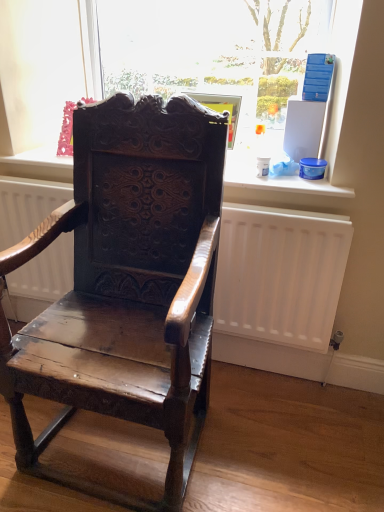
Image resolution: width=384 pixels, height=512 pixels. Describe the element at coordinates (127, 280) in the screenshot. I see `shiny dark wood chair at center` at that location.

Find the location of a particular element. The image size is (384, 512). white matte radiator at center is located at coordinates (280, 274).

From the image's perspective, between transparent glass at upper center and shiny dark wood chair at center, which one is located above?

From the image's view, transparent glass at upper center is above.

Is transparent glass at upper center turned away from shiny dark wood chair at center?

No, transparent glass at upper center is not facing away from shiny dark wood chair at center.

Does transparent glass at upper center have a larger size compared to shiny dark wood chair at center?

No, transparent glass at upper center is not bigger than shiny dark wood chair at center.

Considering the relative positions of transparent glass at upper center and shiny dark wood chair at center in the image provided, is transparent glass at upper center to the left of shiny dark wood chair at center from the viewer's perspective?

Incorrect, transparent glass at upper center is not on the left side of shiny dark wood chair at center.

Is shiny dark wood chair at center turned away from transparent glass at upper center?

Yes.

Identify the location of bay window located on the right of shiny dark wood chair at center. This screenshot has width=384, height=512. [37, 70].

Is shiny dark wood chair at center not within transparent glass at upper center?

Indeed, shiny dark wood chair at center is completely outside transparent glass at upper center.

Is shiny dark wood chair at center far away from transparent glass at upper center?

That's not correct — shiny dark wood chair at center is a little close to transparent glass at upper center.

Which of these two, transparent glass at upper center or white matte radiator at center, is wider?

With larger width is white matte radiator at center.

Considering the points (204, 31) and (66, 193), which point is behind, point (204, 31) or point (66, 193)?

Positioned behind is point (204, 31).

Is white matte radiator at center surrounded by transparent glass at upper center?

No, white matte radiator at center is not inside transparent glass at upper center.

Is white matte radiator at center surrounding transparent glass at upper center?

Actually, transparent glass at upper center is outside white matte radiator at center.

Does point (260, 261) come behind point (60, 20)?

No, (260, 261) is closer to viewer.

Is white matte radiator at center looking in the opposite direction of transparent glass at upper center?

white matte radiator at center is not turned away from transparent glass at upper center.

Relative to transparent glass at upper center, is white matte radiator at center in front or behind?

white matte radiator at center is positioned closer to the viewer than transparent glass at upper center.

In the image, there is a shiny dark wood chair at center. Identify the location of radiator below it (from a real-world perspective). The image size is (384, 512). (280, 274).

Considering the points (238, 307) and (109, 362), which point is in front, point (238, 307) or point (109, 362)?

Point (109, 362)

Who is shorter, white matte radiator at center or shiny dark wood chair at center?

white matte radiator at center.

Which of these two, white matte radiator at center or shiny dark wood chair at center, is wider?

With larger width is shiny dark wood chair at center.

Is shiny dark wood chair at center facing away from white matte radiator at center?

Yes, shiny dark wood chair at center is facing away from white matte radiator at center.

Would you say shiny dark wood chair at center is inside or outside white matte radiator at center?

The correct answer is: outside.

Does shiny dark wood chair at center come behind white matte radiator at center?

No.

From a real-world perspective, which is physically above, shiny dark wood chair at center or white matte radiator at center?

In real-world perspective, shiny dark wood chair at center is above.

At what (x,y) coordinates should I click in order to perform the action: click on bay window behind the shiny dark wood chair at center. Please return your answer as a coordinate pair (x, y). Looking at the image, I should click on (37, 70).

In the image, there is a shiny dark wood chair at center. Identify the location of bay window above it (from the image's perspective). (37, 70).

Considering their positions, is white matte radiator at center positioned further to shiny dark wood chair at center than transparent glass at upper center?

transparent glass at upper center is further to shiny dark wood chair at center.

From the picture: Based on their spatial positions, is shiny dark wood chair at center or white matte radiator at center closer to transparent glass at upper center?

white matte radiator at center is positioned closer to the anchor transparent glass at upper center.

Consider the image. When comparing their distances from white matte radiator at center, does shiny dark wood chair at center or transparent glass at upper center seem further?

transparent glass at upper center lies further to white matte radiator at center than the other object.

Looking at this image, based on their spatial positions, is transparent glass at upper center or shiny dark wood chair at center further from white matte radiator at center?

transparent glass at upper center is positioned further to the anchor white matte radiator at center.

When comparing their distances from shiny dark wood chair at center, does transparent glass at upper center or white matte radiator at center seem further?

Based on the image, transparent glass at upper center appears to be further to shiny dark wood chair at center.

Which object lies nearer to the anchor point transparent glass at upper center, white matte radiator at center or shiny dark wood chair at center?

white matte radiator at center is positioned closer to the anchor transparent glass at upper center.

The width and height of the screenshot is (384, 512). Find the location of `radiator that lies between transparent glass at upper center and shiny dark wood chair at center from top to bottom`. radiator that lies between transparent glass at upper center and shiny dark wood chair at center from top to bottom is located at coordinates (280, 274).